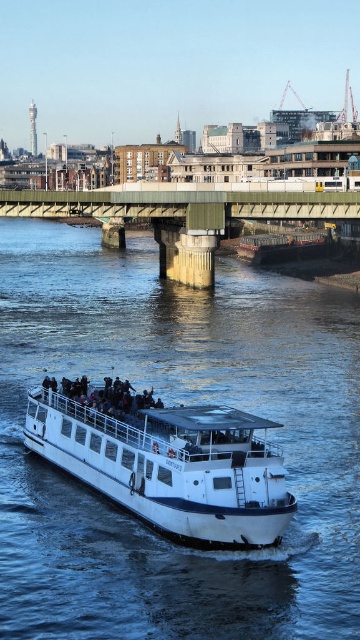
Which is above, blue water at center or metallic gray barge at center?

metallic gray barge at center is above.

Which of these two, blue water at center or metallic gray barge at center, stands shorter?

metallic gray barge at center

Is point (41, 356) positioned in front of point (275, 259)?

Yes.

At what (x,y) coordinates should I click in order to perform the action: click on blue water at center. Please return your answer as a coordinate pair (x, y). Looking at the image, I should click on (176, 403).

In the scene shown: How much distance is there between white glossy boat at center and metallic gray barge at center?

white glossy boat at center and metallic gray barge at center are 88.53 meters apart.

Does white glossy boat at center appear over metallic gray barge at center?

Actually, white glossy boat at center is below metallic gray barge at center.

The height and width of the screenshot is (640, 360). In order to click on white glossy boat at center in this screenshot , I will do `click(165, 460)`.

Find the location of a particular element. Image resolution: width=360 pixels, height=640 pixels. white glossy boat at center is located at coordinates (165, 460).

Can you confirm if blue water at center is smaller than green concrete bridge at center?

Actually, blue water at center might be larger than green concrete bridge at center.

Between blue water at center and green concrete bridge at center, which one is positioned lower?

blue water at center is below.

Identify the location of blue water at center. This screenshot has width=360, height=640. (176, 403).